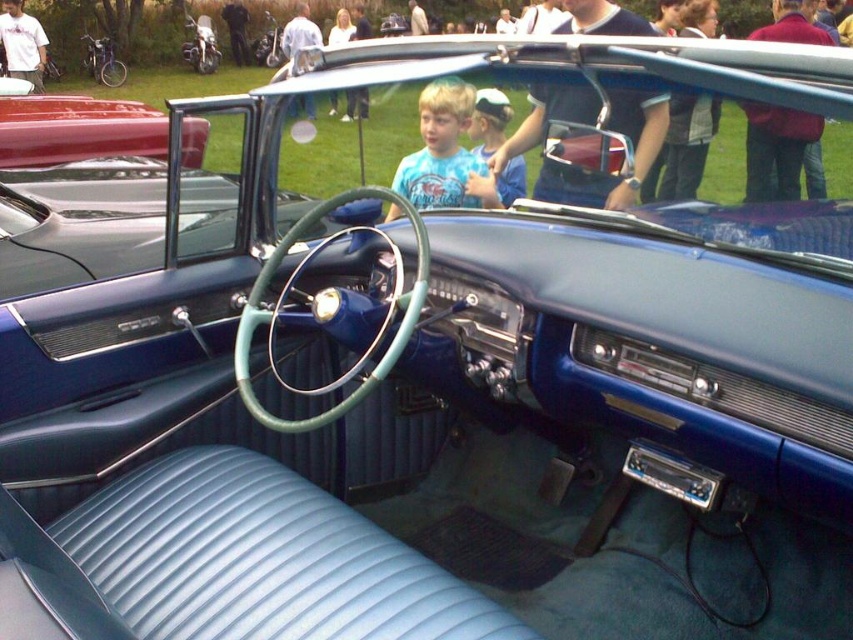
You are sitting in the vintage car and want to place a blue cotton shirt at center on the dashboard. Based on its current position, is the shirt already on the dashboard?

The blue cotton shirt at center is located at point (445, 154), which is not on the dashboard. The dashboard is part of the car interior described in the scene, so the shirt is not currently placed there.

You are a mechanic working on a vintage car. You need to place a protective cover over the blue leather dashboard at center and the blue leather cap at upper center. Which object requires a wider cover?

The blue leather dashboard at center requires a wider cover because it is wider than the blue leather cap at upper center.